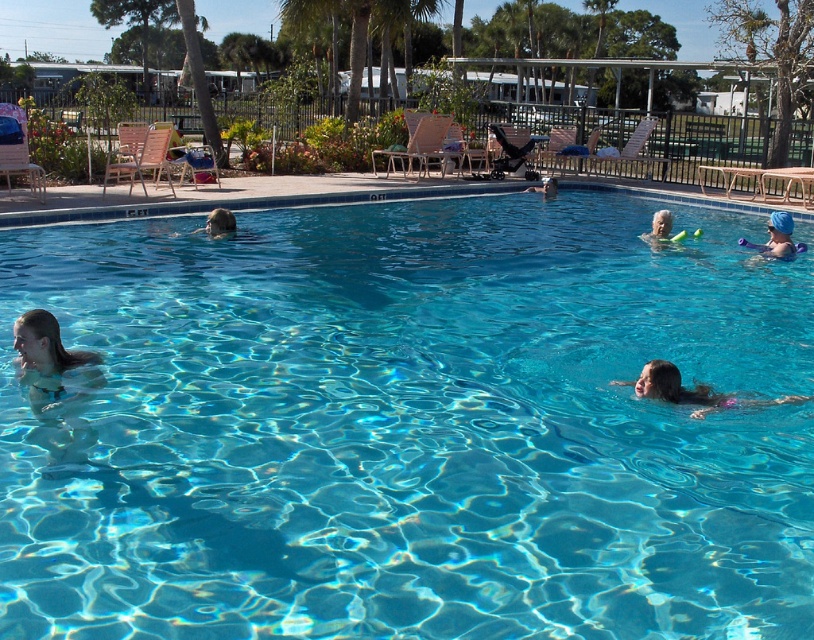
You are a photographer trying to capture a group photo of the smooth skin girl at lower center and the smooth skin head at center. Since you want both subjects to appear in the same frame, which subject should you position closer to the camera to ensure they both fit well?

The smooth skin girl at lower center is taller than the smooth skin head at center, so positioning the smooth skin head at center closer to the camera will help balance their sizes in the photo.

You are a photographer standing at the edge of the pool. You want to take a photo that includes both the transparent blue water at center and the smooth skin person at center. Based on their positions, which object should be placed to the left in the frame?

The transparent blue water at center is positioned on the left side of smooth skin person at center, so in the frame, the transparent blue water at center should be placed to the left of the smooth skin person at center.

You are standing at the edge of the pool and want to reach the blue rubber swim cap at upper right without stepping into the water. Can you do this by moving along the pool edge from the transparent blue water at center?

The transparent blue water at center is closer to the viewer than the blue rubber swim cap at upper right, so you would need to move away from the water towards the swim cap. However, since the swim cap is at the upper right, you might need to walk around the pool edge to reach it without entering the water.